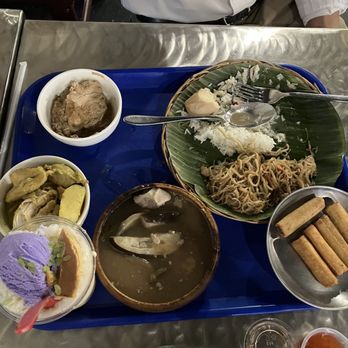
You are a GUI agent. You are given a task and a screenshot of the screen. Output one action in this format:
    pyautogui.click(x=<x>, y=<y>)
    Task: Click on the table
    The image size is (348, 348).
    Given the screenshot: What is the action you would take?
    pyautogui.click(x=120, y=40)